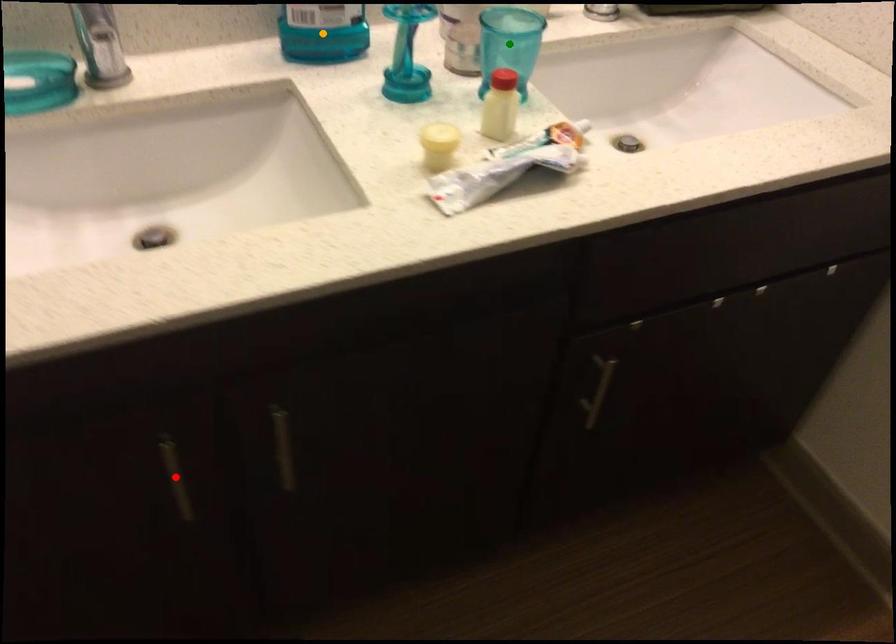
Order these from nearest to farthest:
- orange point
- red point
- green point

red point, green point, orange point